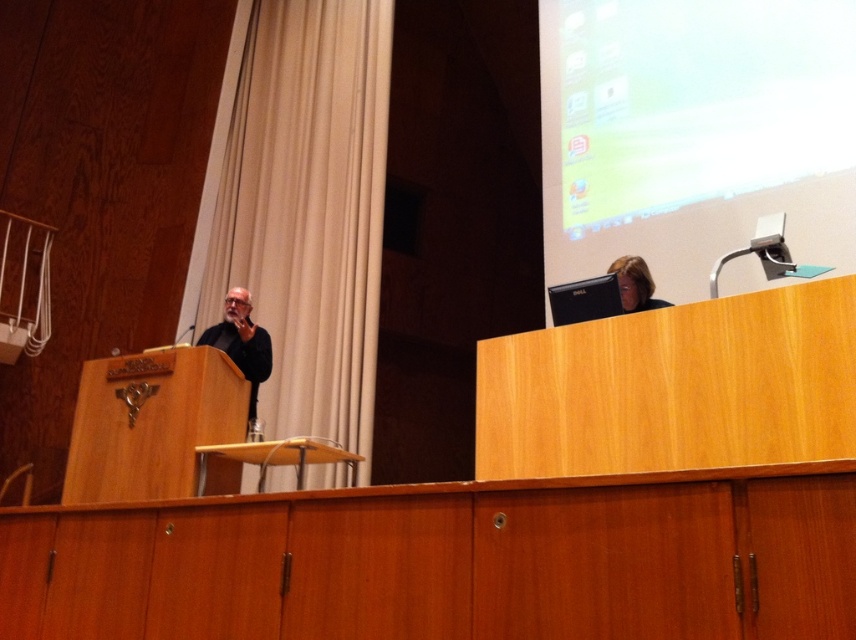
Looking at this image, you are a photographer standing in the lecture hall. You need to position yourself so that you can capture both the beige fabric curtain at left and the camera in the scene. What is the minimum distance you should move forward to ensure both are in frame?

The minimum distance to move forward would be 15.18 feet to ensure both the beige fabric curtain at left and the camera are within the frame.

You are standing in the lecture hall and need to walk to the front of the room. There are two points marked in the scene. Which point should you aim for to reach the front first? The points are point (x=825, y=200) and point (x=233, y=268).

Point (x=825, y=200) is in front of point (x=233, y=268), so you should aim for point (x=825, y=200) to reach the front first.

You are a guest speaker at the event and need to adjust the screen behind you. You see the beige fabric curtain at left and the black matte jacket at left. Which object is closer to you so you can reach it first?

The beige fabric curtain at left is closer to you than the black matte jacket at left, so you can reach it first.